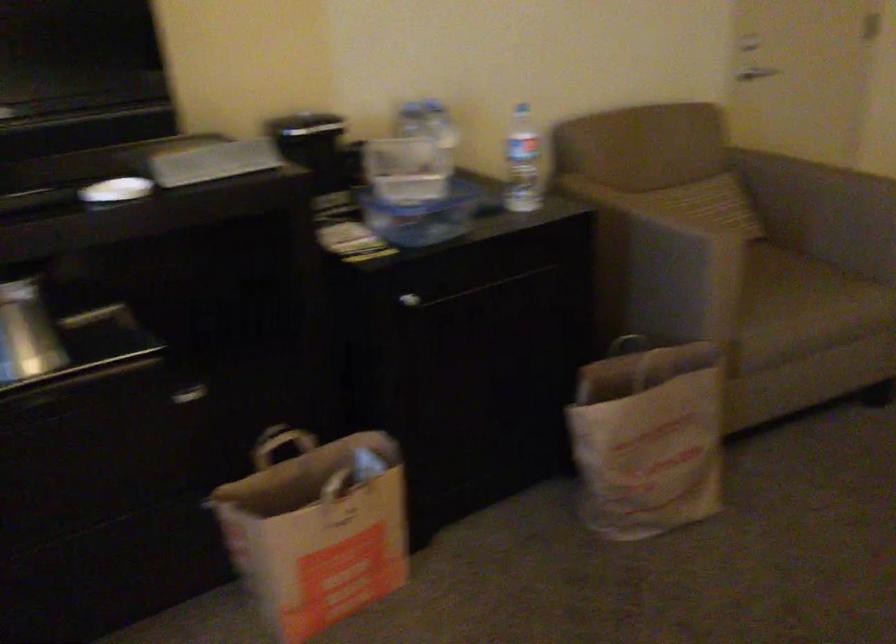
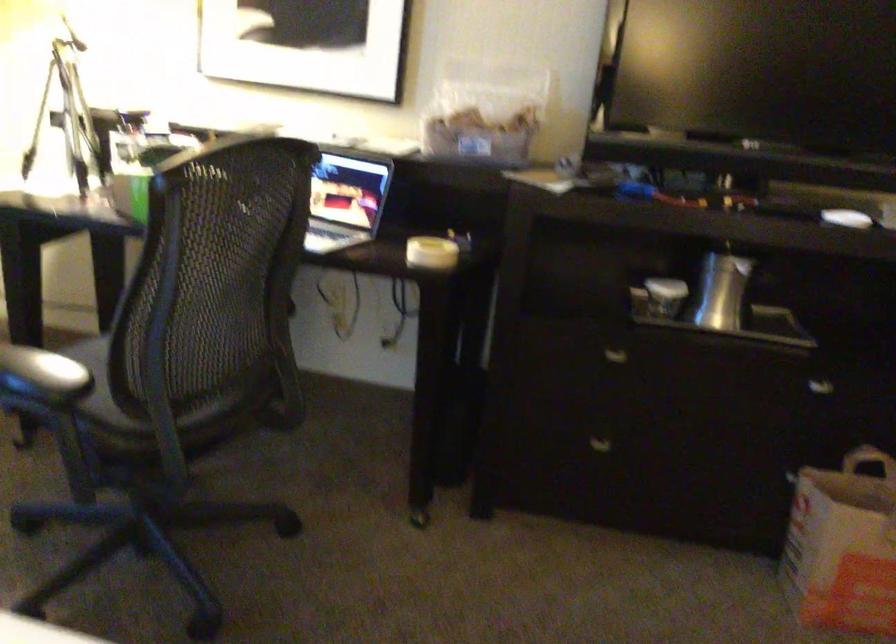
Locate, in the second image, the point that corresponds to pixel 279 451 in the first image.

(867, 460)